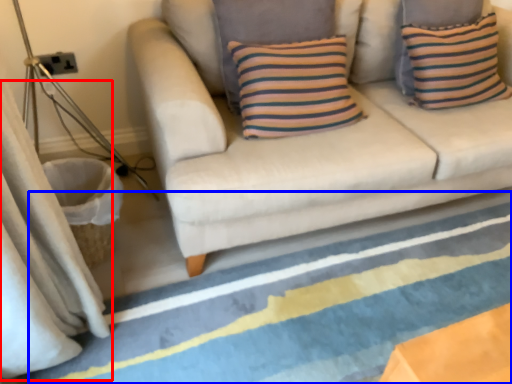
Question: Which object is closer to the camera taking this photo, curtain (highlighted by a red box) or strip (highlighted by a blue box)?

Choices:
 (A) curtain
 (B) strip

Answer: (A)